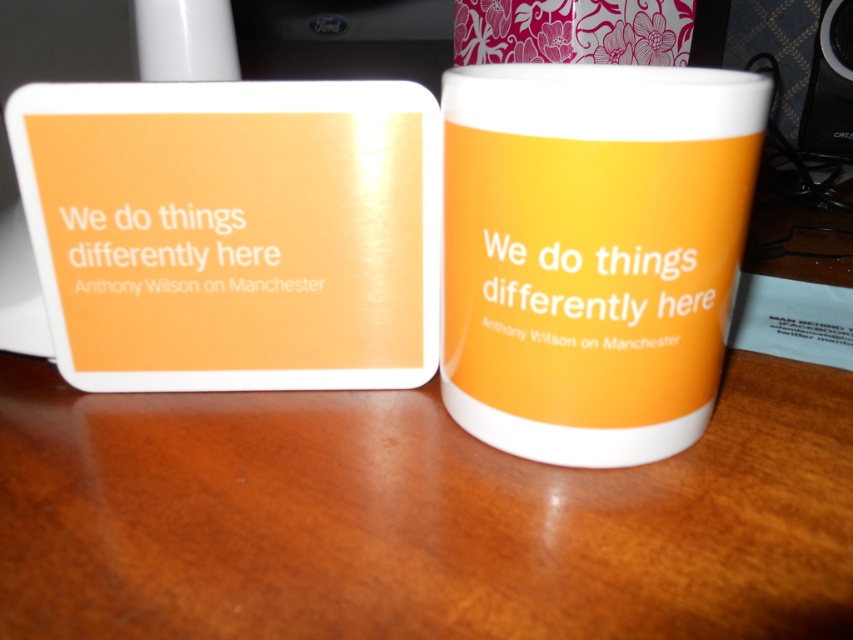
Between matte ceramic mug at center and black plastic speaker at upper right, which one has less height?

Standing shorter between the two is matte ceramic mug at center.

Who is positioned more to the right, matte ceramic mug at center or black plastic speaker at upper right?

black plastic speaker at upper right

Where is `matte ceramic mug at center`? Image resolution: width=853 pixels, height=640 pixels. matte ceramic mug at center is located at coordinates (592, 252).